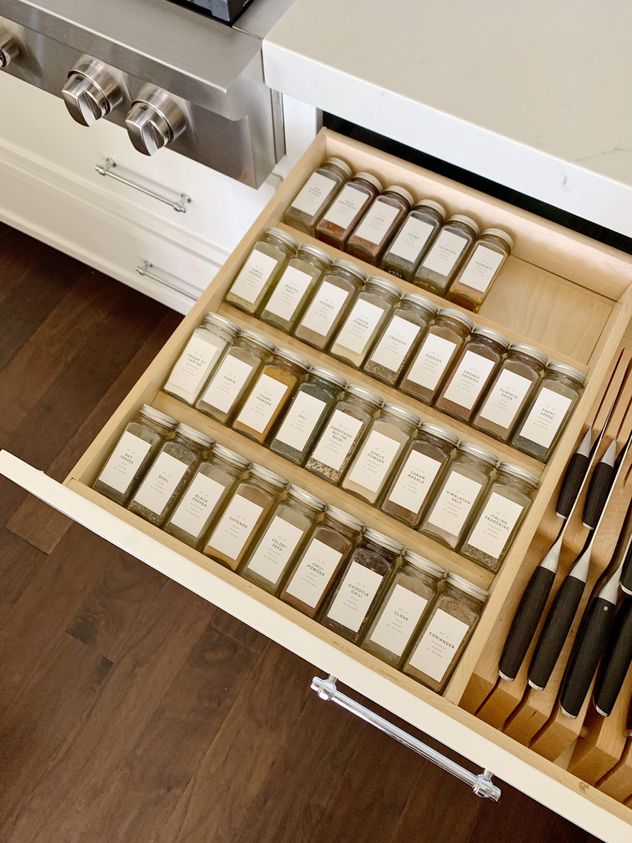
Identify the location of open drawer. (284, 636).